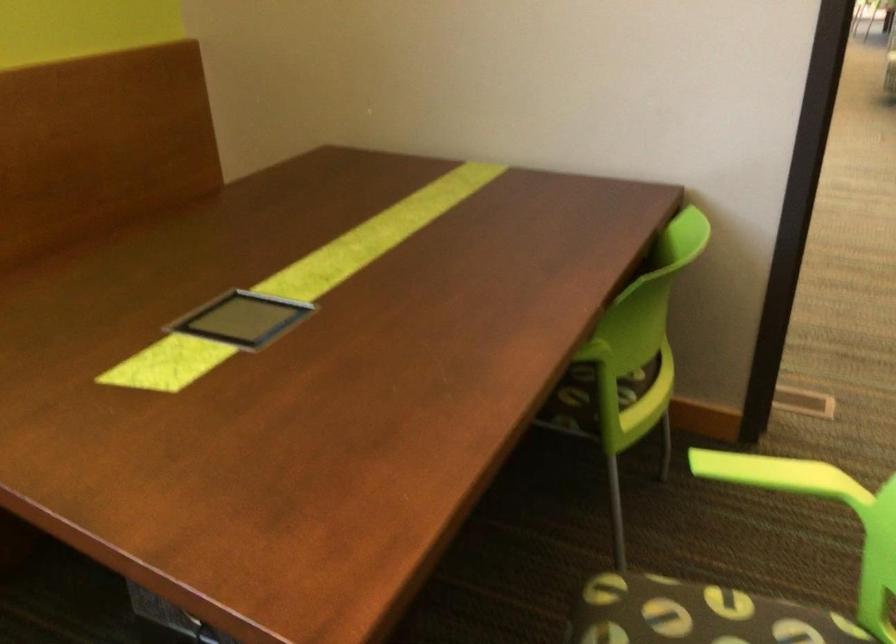
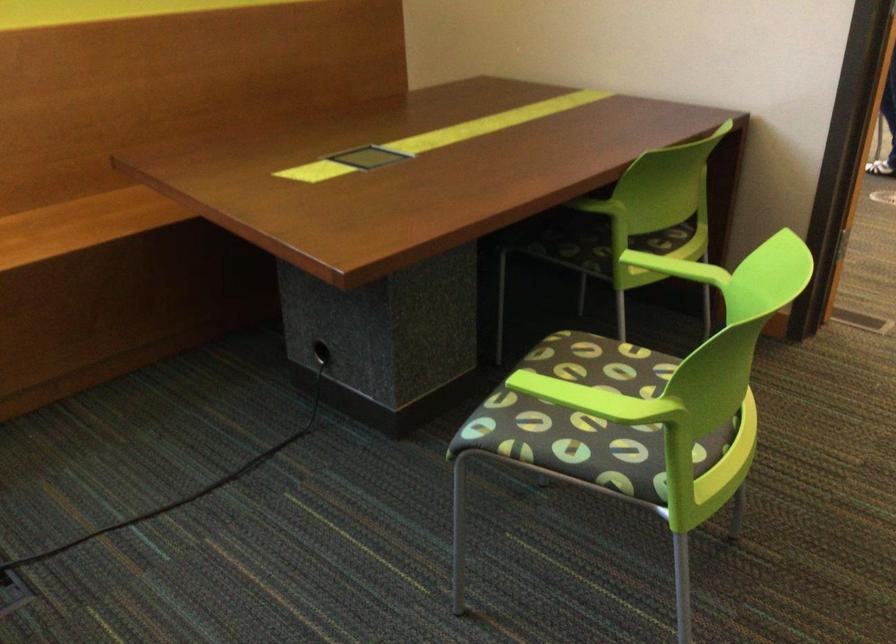
Locate, in the second image, the point that corresponds to point 771,469 in the first image.

(676, 268)